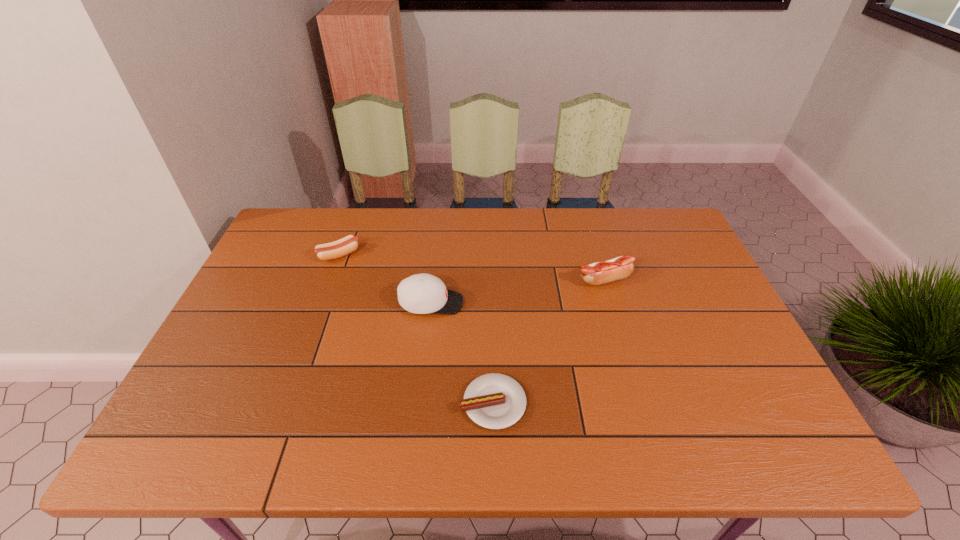
Select which object appears as the second closest to the shortest sausage. Please provide its 2D coordinates. Your answer should be formatted as a tuple, i.e. [(x, y)], where the tuple contains the x and y coordinates of a point satisfying the conditions above.

[(621, 267)]

Point out which sausage is positioned as the second nearest to the second tallest sausage. Please provide its 2D coordinates. Your answer should be formatted as a tuple, i.e. [(x, y)], where the tuple contains the x and y coordinates of a point satisfying the conditions above.

[(621, 267)]

I want to click on sausage that is the closest to the rightmost sausage, so click(x=495, y=401).

Where is `blank space that satisfies the following two spatial constraints: 1. on the front side of the third tallest object; 2. on the left side of the tallest sausage`? This screenshot has height=540, width=960. blank space that satisfies the following two spatial constraints: 1. on the front side of the third tallest object; 2. on the left side of the tallest sausage is located at coordinates (330, 279).

Identify the location of free point that satisfies the following two spatial constraints: 1. on the front side of the second farthest sausage; 2. on the front-facing side of the tallest object. The image size is (960, 540). (612, 303).